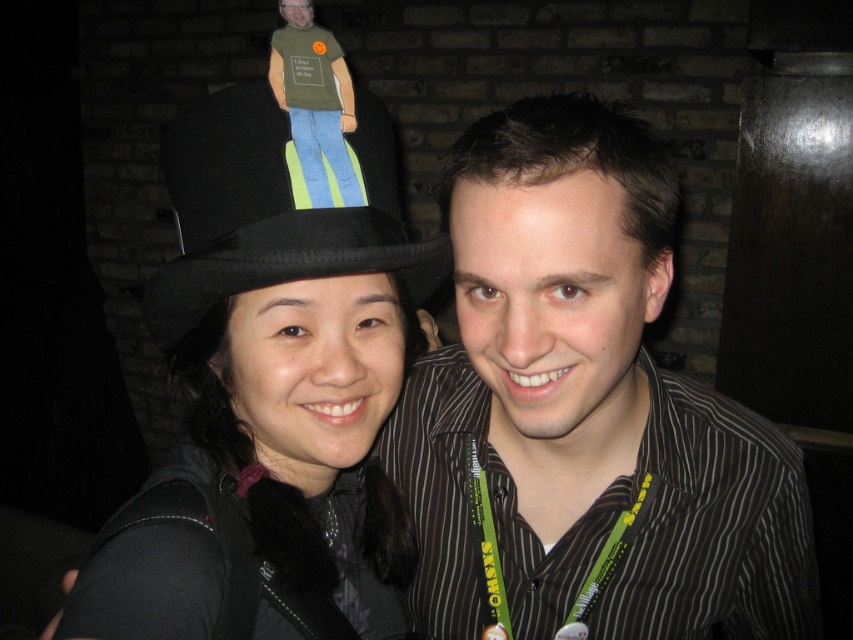
Question: From the image, what is the correct spatial relationship of black felt hat at upper left in relation to black felt fedora at upper left?

Choices:
 (A) below
 (B) above

Answer: (A)

Question: Can you confirm if black felt hat at upper left is smaller than black felt fedora at upper left?

Choices:
 (A) yes
 (B) no

Answer: (B)

Question: Which object is positioned closest to the black felt fedora at upper left?

Choices:
 (A) black felt hat at upper left
 (B) striped cotton shirt at center

Answer: (A)

Question: Does striped cotton shirt at center appear under black felt fedora at upper left?

Choices:
 (A) no
 (B) yes

Answer: (B)

Question: Which object is closer to the camera taking this photo?

Choices:
 (A) black felt hat at upper left
 (B) black felt fedora at upper left

Answer: (B)

Question: Which object is the farthest from the black felt fedora at upper left?

Choices:
 (A) striped cotton shirt at center
 (B) black felt hat at upper left

Answer: (A)